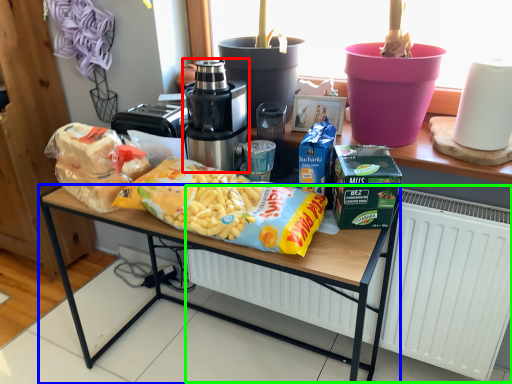
Question: Based on their relative distances, which object is farther from home appliance (highlighted by a red box)? Choose from desk (highlighted by a blue box) and radiator (highlighted by a green box).

Choices:
 (A) desk
 (B) radiator

Answer: (B)